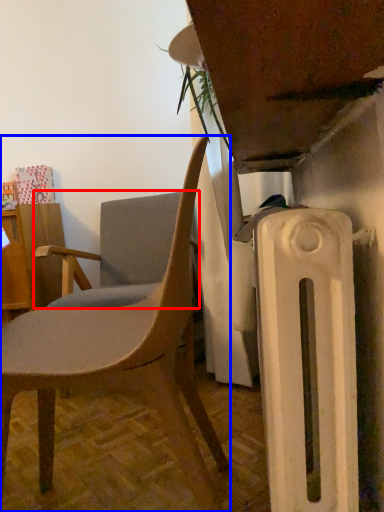
Question: Which point is further to the camera, chair (highlighted by a red box) or chair (highlighted by a blue box)?

Choices:
 (A) chair
 (B) chair

Answer: (A)